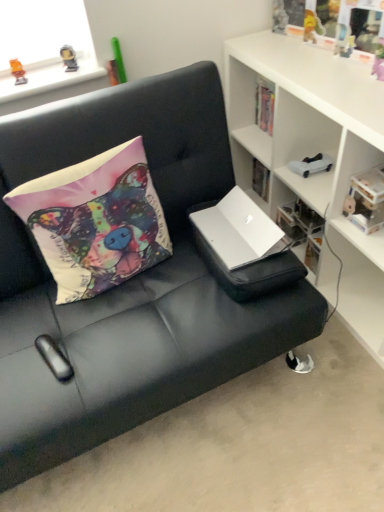
Find the location of a particular element. white matte laptop at center is located at coordinates pyautogui.click(x=248, y=267).

Locate an element on the screen. The image size is (384, 512). matte fabric pillow at upper left is located at coordinates (95, 221).

How much space does metallic gold figurine at upper left, which appears as the first toy when viewed from the top, occupy vertically?

metallic gold figurine at upper left, which appears as the first toy when viewed from the top, is 3.39 inches in height.

This screenshot has height=512, width=384. Describe the element at coordinates (18, 71) in the screenshot. I see `translucent plastic toy at upper left, the 3th toy positioned from the right` at that location.

The image size is (384, 512). What do you see at coordinates (366, 200) in the screenshot? I see `white plastic book at upper right` at bounding box center [366, 200].

Identify the location of white matte laptop at center. The height and width of the screenshot is (512, 384). (248, 267).

From the image's perspective, does translucent plastic toy at upper left, which is counted as the second toy, starting from the bottom, appear lower than matte fabric pillow at upper left?

No, from the image's perspective, translucent plastic toy at upper left, which is counted as the second toy, starting from the bottom, is not beneath matte fabric pillow at upper left.

Is the position of translucent plastic toy at upper left, which is the 2th toy from top to bottom, more distant than that of matte fabric pillow at upper left?

Yes, translucent plastic toy at upper left, which is the 2th toy from top to bottom, is further from the viewer.

Is translucent plastic toy at upper left, the 3th toy positioned from the right, located outside matte fabric pillow at upper left?

Yes, translucent plastic toy at upper left, the 3th toy positioned from the right, is not within matte fabric pillow at upper left.

Is white matte cabinet at upper right looking in the opposite direction of black leather couch at center?

No, white matte cabinet at upper right is not facing the opposite direction of black leather couch at center.

Which point is more forward, (x=370, y=108) or (x=90, y=123)?

The point (x=370, y=108) is in front.

Is white matte cabinet at upper right in contact with black leather couch at center?

No, white matte cabinet at upper right is not with black leather couch at center.

Does white matte cabinet at upper right have a greater width compared to black leather couch at center?

No, white matte cabinet at upper right is not wider than black leather couch at center.

From the image's perspective, does white matte cabinet at upper right appear higher than clear plastic storage at center?

Indeed, from the image's perspective, white matte cabinet at upper right is shown above clear plastic storage at center.

In the image, there is a white matte cabinet at upper right. Where is `shelf below it (from the image's perspective)`? The image size is (384, 512). shelf below it (from the image's perspective) is located at coordinates (309, 187).

How different are the orientations of white matte cabinet at upper right and clear plastic storage at center in degrees?

There is a 0.503-degree angle between the facing directions of white matte cabinet at upper right and clear plastic storage at center.

Which point is more forward, (346, 268) or (295, 184)?

The point (295, 184) is in front.

Is clear plastic storage at center at the left side of white matte laptop at center?

No, clear plastic storage at center is not to the left of white matte laptop at center.

Considering the sizes of clear plastic storage at center and white matte laptop at center in the image, is clear plastic storage at center bigger or smaller than white matte laptop at center?

Clearly, clear plastic storage at center is smaller in size than white matte laptop at center.

Is clear plastic storage at center oriented towards white matte laptop at center?

No, clear plastic storage at center is not turned towards white matte laptop at center.

Does point (312, 206) come closer to viewer compared to point (267, 289)?

That is False.

Is white matte laptop at center beside clear plastic storage at center?

No.

Is white matte laptop at center further to the viewer compared to clear plastic storage at center?

No, the depth of white matte laptop at center is less than that of clear plastic storage at center.

Consider the image. Is white matte laptop at center oriented away from clear plastic storage at center?

white matte laptop at center does not have its back to clear plastic storage at center.

I want to click on the footrest that is in front of the clear plastic storage at center, so click(248, 267).

In the scene shown: Is black leather couch at center to the left or to the right of white matte laptop at center in the image?

From the image, it's evident that black leather couch at center is to the left of white matte laptop at center.

Which is in front, point (42, 444) or point (199, 230)?

The point (42, 444) is more forward.

Which of these two, black leather couch at center or white matte laptop at center, is bigger?

With larger size is black leather couch at center.

Could you measure the distance between white plastic toy car at upper right, which is the third toy in left-to-right order, and black leather couch at center?

30.57 inches.

Can you confirm if white plastic toy car at upper right, the third toy when ordered from front to back, is wider than black leather couch at center?

Incorrect, the width of white plastic toy car at upper right, the third toy when ordered from front to back, does not surpass that of black leather couch at center.

Is white plastic toy car at upper right, the 1th toy in the right-to-left sequence, completely or partially outside of black leather couch at center?

Yes.

Considering the positions of objects white plastic toy car at upper right, the 1th toy in the right-to-left sequence, and black leather couch at center in the image provided, who is in front, white plastic toy car at upper right, the 1th toy in the right-to-left sequence, or black leather couch at center?

black leather couch at center.

Which toy is the 2nd one when counting from the left side of the matte fabric pillow at upper left? Please provide its 2D coordinates.

[(18, 71)]

Where is `cabinetry located above the black leather couch at center (from the image's perspective)`? cabinetry located above the black leather couch at center (from the image's perspective) is located at coordinates (315, 152).

When comparing their distances from matte fabric pillow at upper left, does black leather couch at center or white matte laptop at center seem closer?

black leather couch at center.

From the image, which object appears to be nearer to white matte laptop at center, metallic gold figurine at upper left, which appears as the first toy when viewed from the top, or clear plastic storage at center?

clear plastic storage at center lies closer to white matte laptop at center than the other object.

In the scene shown: Looking at the image, which one is located closer to matte fabric pillow at upper left, translucent plastic toy at upper left, which is counted as the 1th toy, starting from the front, or clear plastic storage at center?

translucent plastic toy at upper left, which is counted as the 1th toy, starting from the front, is closer to matte fabric pillow at upper left.

Estimate the real-world distances between objects in this image. Which object is closer to white matte cabinet at upper right, black leather couch at center or metallic gold figurine at upper left, which ranks as the second toy in right-to-left order?

black leather couch at center is positioned closer to the anchor white matte cabinet at upper right.

Considering their positions, is white matte cabinet at upper right positioned closer to white matte laptop at center than matte fabric pillow at upper left?

matte fabric pillow at upper left is closer to white matte laptop at center.

Looking at the image, which one is located closer to white plastic toy car at upper right, which is the first toy in back-to-front order, white matte cabinet at upper right or matte fabric pillow at upper left?

white matte cabinet at upper right is positioned closer to the anchor white plastic toy car at upper right, which is the first toy in back-to-front order.

Based on their spatial positions, is white matte laptop at center or translucent plastic toy at upper left, which is the 3th toy in back-to-front order, closer to matte fabric pillow at upper left?

white matte laptop at center lies closer to matte fabric pillow at upper left than the other object.

Based on their spatial positions, is clear plastic storage at center or white matte laptop at center closer to white matte cabinet at upper right?

clear plastic storage at center is closer to white matte cabinet at upper right.

Where is `cabinetry between black leather couch at center and white plastic toy car at upper right, which is the first toy in back-to-front order, in the front-back direction`? cabinetry between black leather couch at center and white plastic toy car at upper right, which is the first toy in back-to-front order, in the front-back direction is located at coordinates 315,152.

The width and height of the screenshot is (384, 512). I want to click on shelf situated between matte fabric pillow at upper left and white plastic book at upper right from left to right, so click(x=309, y=187).

Find the location of a particular element. Image resolution: width=384 pixels, height=512 pixels. studio couch between translucent plastic toy at upper left, which is counted as the 1th toy, starting from the front, and clear plastic storage at center from left to right is located at coordinates (127, 281).

You are a GUI agent. You are given a task and a screenshot of the screen. Output one action in this format:
    pyautogui.click(x=<x>, y=<y>)
    Task: Click on the pillow between black leather couch at center and metallic gold figurine at upper left, the 2th toy viewed from the left, along the z-axis
    The width and height of the screenshot is (384, 512).
    Given the screenshot: What is the action you would take?
    pyautogui.click(x=95, y=221)